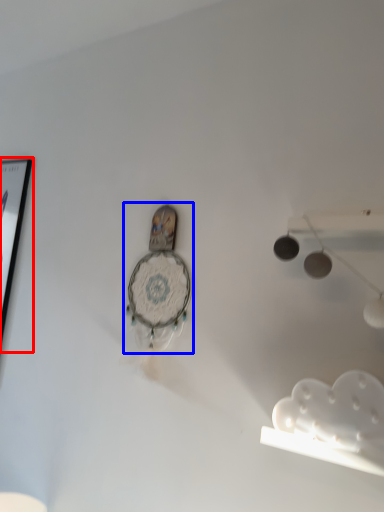
Question: Which object is further to the camera taking this photo, picture frame (highlighted by a red box) or clock (highlighted by a blue box)?

Choices:
 (A) picture frame
 (B) clock

Answer: (A)